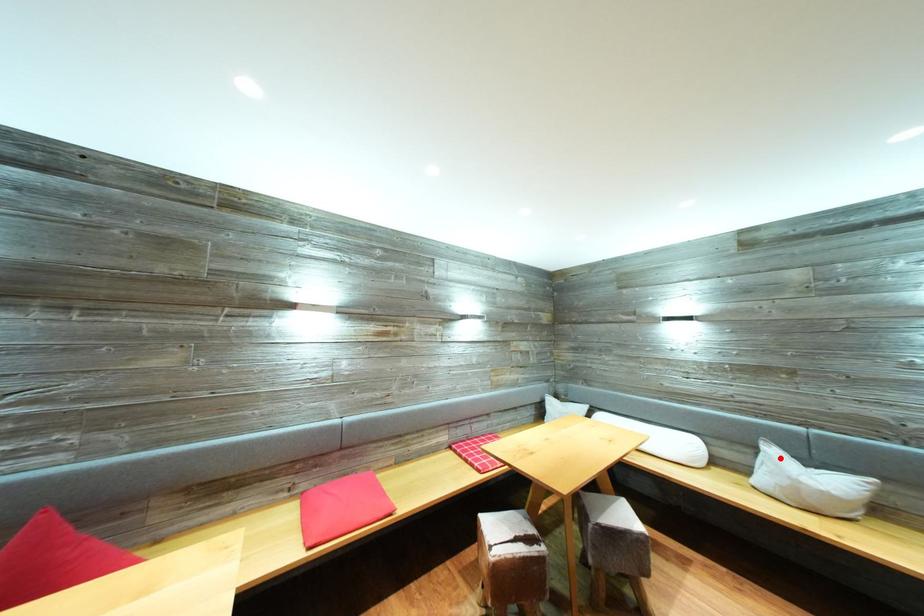
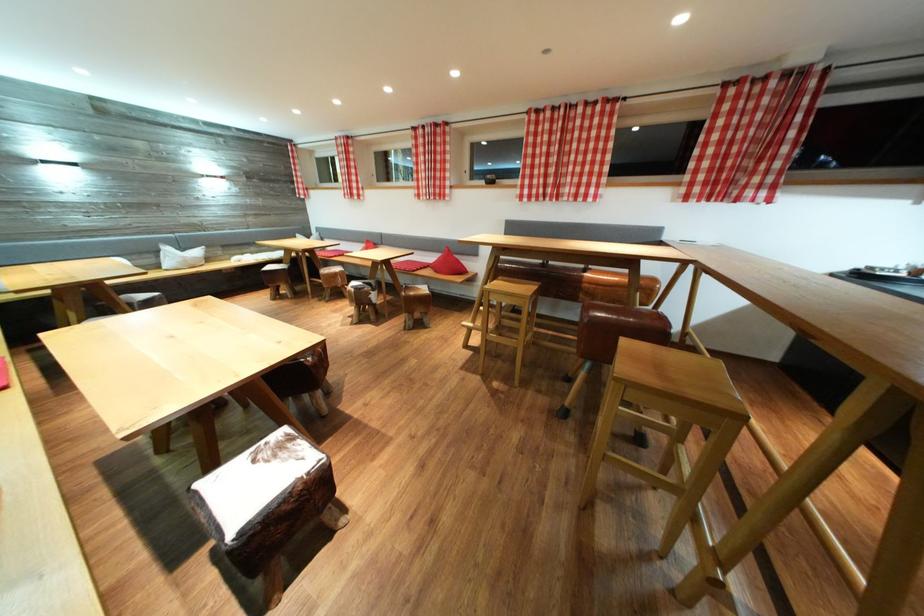
In the second image, find the point that corresponds to the highlighted location in the first image.

(176, 254)